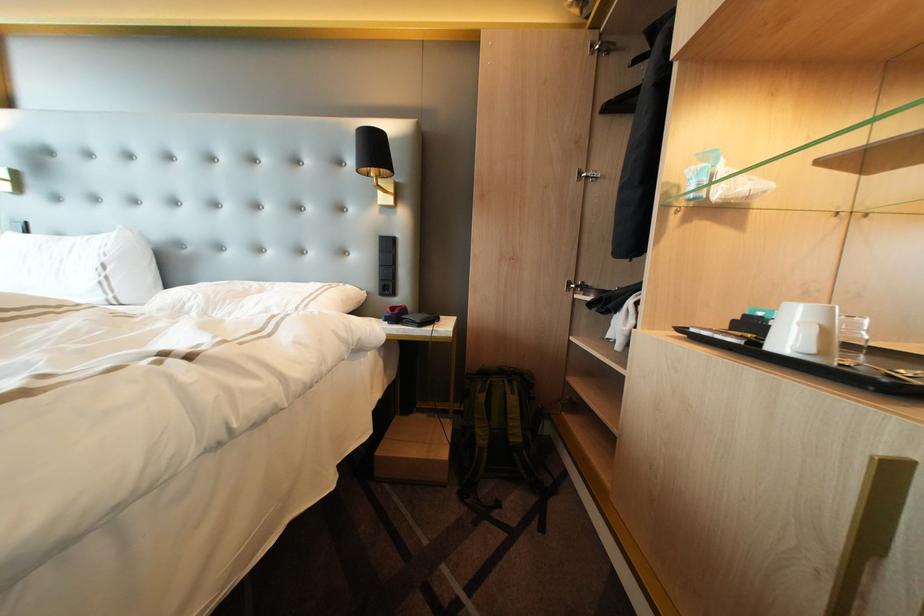
Which object does [386,291] point to?

It corresponds to the black clothes hanger in the image.